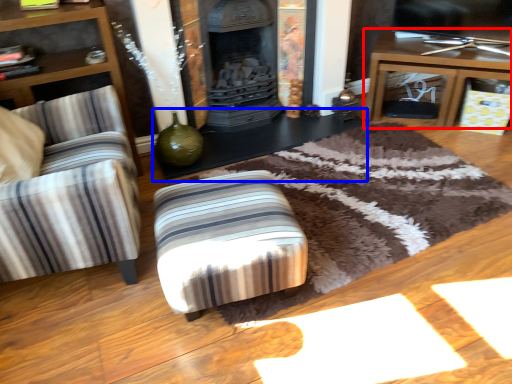
Question: Which object is further to the camera taking this photo, table (highlighted by a red box) or table (highlighted by a blue box)?

Choices:
 (A) table
 (B) table

Answer: (A)